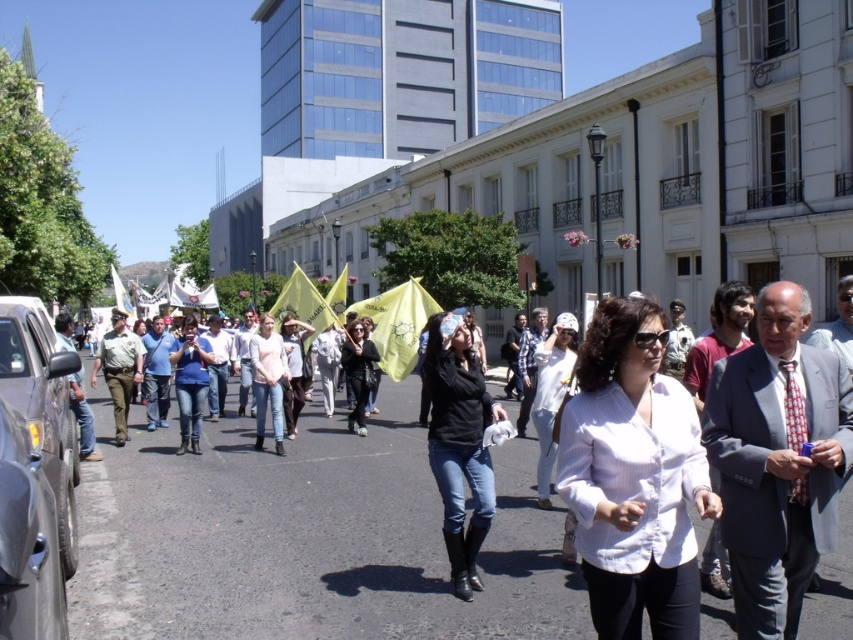
Question: Based on their relative distances, which object is nearer to the white textured blouse at center?

Choices:
 (A) white shirt at center
 (B) light pink shirt at center

Answer: (A)

Question: From the image, what is the correct spatial relationship of matte blue shirt at center in relation to light pink shirt at center?

Choices:
 (A) above
 (B) below

Answer: (B)

Question: Can you confirm if white textured blouse at center is positioned to the left of matte blue shirt at center?

Choices:
 (A) no
 (B) yes

Answer: (A)

Question: Which of the following is the farthest from the observer?

Choices:
 (A) (190, 358)
 (B) (219, 438)

Answer: (B)

Question: Which point is closer to the camera?

Choices:
 (A) matte blue shirt at center
 (B) light pink shirt at center
 (C) black matte jacket at center
 (D) gray pinstripe suit at center

Answer: (D)

Question: Can you confirm if white shirt at center is wider than black matte jacket at center?

Choices:
 (A) yes
 (B) no

Answer: (A)